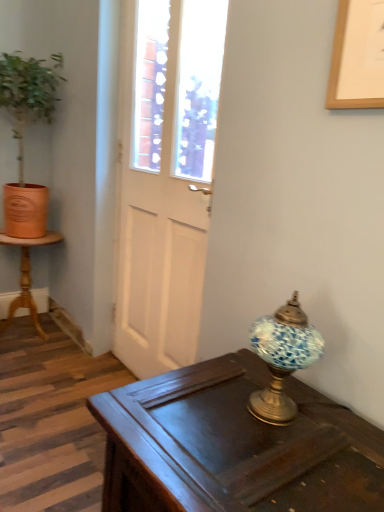
Locate an element on the screen. The image size is (384, 512). wooden pedestal table at left is located at coordinates (26, 277).

This screenshot has height=512, width=384. What do you see at coordinates (23, 136) in the screenshot? I see `terracotta pot at left` at bounding box center [23, 136].

Describe the element at coordinates (354, 59) in the screenshot. The width and height of the screenshot is (384, 512). I see `wooden picture frame at upper right` at that location.

Identify the location of blue mosaic glass lamp at right. (282, 358).

Where is `wooden pedestal table at left`? wooden pedestal table at left is located at coordinates (26, 277).

Is dark wood desk at center smaller than blue mosaic glass lamp at right?

No, dark wood desk at center is not smaller than blue mosaic glass lamp at right.

Is dark wood desk at center not close to blue mosaic glass lamp at right?

dark wood desk at center is actually quite close to blue mosaic glass lamp at right.

Is dark wood desk at center inside or outside of blue mosaic glass lamp at right?

dark wood desk at center exists outside the volume of blue mosaic glass lamp at right.

From the image's perspective, would you say dark wood desk at center is shown under blue mosaic glass lamp at right?

Yes.

Is wooden picture frame at upper right far from terracotta pot at left?

That's right, there is a large distance between wooden picture frame at upper right and terracotta pot at left.

From the image's perspective, which object appears higher, wooden picture frame at upper right or terracotta pot at left?

From the image's view, terracotta pot at left is above.

Considering the relative sizes of wooden picture frame at upper right and terracotta pot at left in the image provided, is wooden picture frame at upper right bigger than terracotta pot at left?

Incorrect, wooden picture frame at upper right is not larger than terracotta pot at left.

Who is smaller, white glossy door at center or wooden pedestal table at left?

white glossy door at center.

Can you confirm if white glossy door at center is positioned to the left of wooden pedestal table at left?

No, white glossy door at center is not to the left of wooden pedestal table at left.

Is white glossy door at center turned away from wooden pedestal table at left?

No, white glossy door at center is not facing away from wooden pedestal table at left.

Considering the relative positions of white glossy door at center and wooden pedestal table at left in the image provided, is white glossy door at center in front of wooden pedestal table at left?

Yes, white glossy door at center is closer to the camera.

Which object is closer to the camera taking this photo, terracotta pot at left or blue mosaic glass lamp at right?

blue mosaic glass lamp at right.

Where is `houseplant lying on the left of blue mosaic glass lamp at right`? houseplant lying on the left of blue mosaic glass lamp at right is located at coordinates (23, 136).

Does terracotta pot at left turn towards blue mosaic glass lamp at right?

Yes, terracotta pot at left is oriented towards blue mosaic glass lamp at right.

Does terracotta pot at left have a greater width compared to blue mosaic glass lamp at right?

Yes.

Between wooden picture frame at upper right and white glossy door at center, which one is positioned behind?

white glossy door at center is more distant.

Can you tell me how much wooden picture frame at upper right and white glossy door at center differ in facing direction?

There is a 0.347-degree angle between the facing directions of wooden picture frame at upper right and white glossy door at center.

Considering the relative sizes of wooden picture frame at upper right and white glossy door at center in the image provided, is wooden picture frame at upper right taller than white glossy door at center?

In fact, wooden picture frame at upper right may be shorter than white glossy door at center.

Does wooden picture frame at upper right have a smaller size compared to white glossy door at center?

Indeed, wooden picture frame at upper right has a smaller size compared to white glossy door at center.

Locate an element on the screen. This screenshot has width=384, height=512. desk lying below the blue mosaic glass lamp at right (from the image's perspective) is located at coordinates (233, 446).

Is point (294, 296) positioned after point (193, 456)?

Yes, point (294, 296) is behind point (193, 456).

From the picture: From the image's perspective, is blue mosaic glass lamp at right on dark wood desk at center?

Yes, from the image's perspective, blue mosaic glass lamp at right is over dark wood desk at center.

Could blue mosaic glass lamp at right be considered to be inside white glossy door at center?

No, blue mosaic glass lamp at right is not inside white glossy door at center.

Is there a large distance between white glossy door at center and blue mosaic glass lamp at right?

No, white glossy door at center is not far away from blue mosaic glass lamp at right.

Where is `lamp on the right of white glossy door at center`? The height and width of the screenshot is (512, 384). lamp on the right of white glossy door at center is located at coordinates (282, 358).

Locate an element on the screen. The image size is (384, 512). lamp behind the dark wood desk at center is located at coordinates [282, 358].

Find the location of `picture frame below the terracotta pot at left (from the image's perspective)`. picture frame below the terracotta pot at left (from the image's perspective) is located at coordinates (354, 59).

When comparing their distances from terracotta pot at left, does blue mosaic glass lamp at right or dark wood desk at center seem closer?

Based on the image, dark wood desk at center appears to be nearer to terracotta pot at left.

In the scene shown: Estimate the real-world distances between objects in this image. Which object is further from terracotta pot at left, white glossy door at center or dark wood desk at center?

dark wood desk at center is positioned further to the anchor terracotta pot at left.

Looking at the image, which one is located closer to white glossy door at center, terracotta pot at left or dark wood desk at center?

The object closer to white glossy door at center is dark wood desk at center.

Estimate the real-world distances between objects in this image. Which object is further from dark wood desk at center, wooden pedestal table at left or white glossy door at center?

wooden pedestal table at left is further to dark wood desk at center.

Based on the photo, based on their spatial positions, is dark wood desk at center or terracotta pot at left further from white glossy door at center?

terracotta pot at left is positioned further to the anchor white glossy door at center.

Looking at the image, which one is located closer to wooden pedestal table at left, wooden picture frame at upper right or terracotta pot at left?

Based on the image, terracotta pot at left appears to be nearer to wooden pedestal table at left.

Looking at the image, which one is located closer to blue mosaic glass lamp at right, white glossy door at center or terracotta pot at left?

white glossy door at center.

From the image, which object appears to be farther from terracotta pot at left, wooden pedestal table at left or dark wood desk at center?

dark wood desk at center is further to terracotta pot at left.

Identify the location of door positioned between blue mosaic glass lamp at right and wooden pedestal table at left from near to far. This screenshot has width=384, height=512. (167, 179).

Where is `door between wooden picture frame at upper right and wooden pedestal table at left along the z-axis`? The height and width of the screenshot is (512, 384). door between wooden picture frame at upper right and wooden pedestal table at left along the z-axis is located at coordinates (167, 179).

Locate an element on the screen. Image resolution: width=384 pixels, height=512 pixels. picture frame that lies between terracotta pot at left and dark wood desk at center from top to bottom is located at coordinates (354, 59).

The width and height of the screenshot is (384, 512). In order to click on lamp that lies between white glossy door at center and dark wood desk at center from top to bottom in this screenshot , I will do `click(282, 358)`.